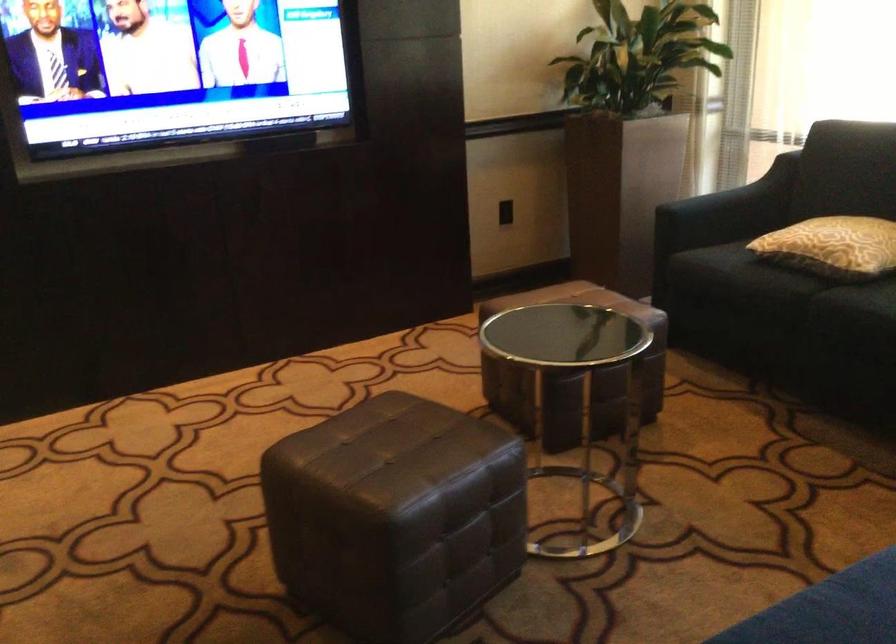
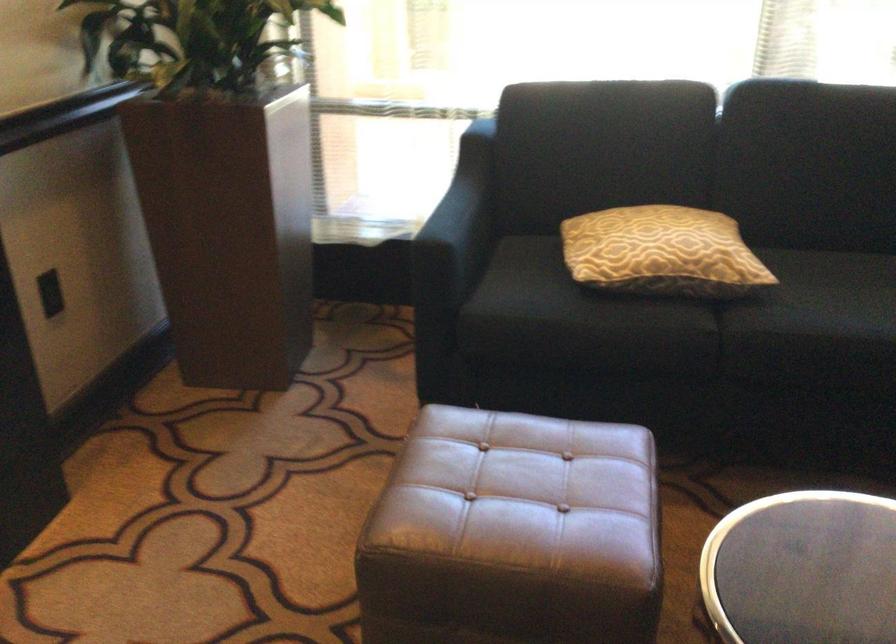
Locate, in the second image, the point that corresponds to pixel 702 200 in the first image.

(458, 225)